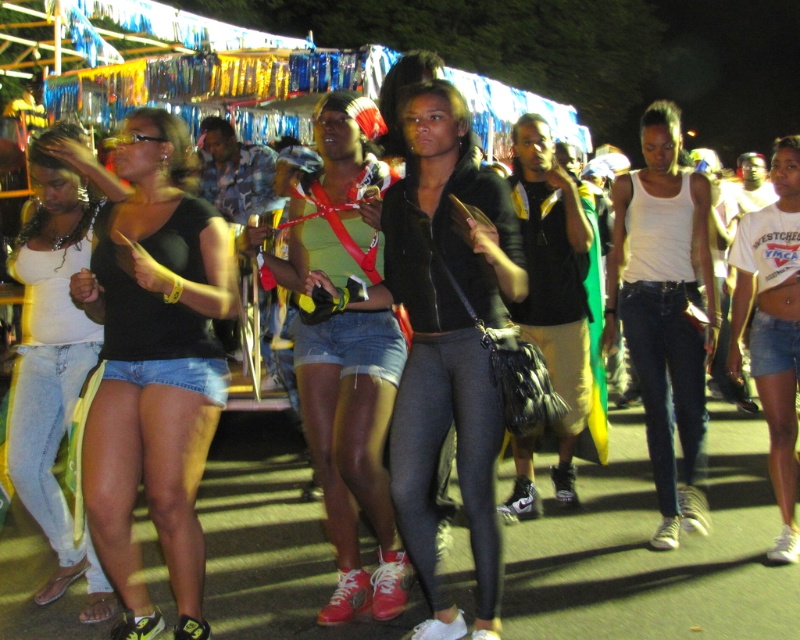
Based on the photo, you are a photographer trying to capture the best shot of the two people at the center of the scene. The denim shorts at center and the white matte tank top at center are both in focus. Which clothing item will appear bigger in your photo?

The denim shorts at center will appear bigger in the photo because it is larger in size than the white matte tank top at center.

You are standing at the origin point of the coordinate system in the image. You need to locate the denim shorts at center. In which direction should you move to reach it?

The denim shorts at center is located at coordinate point 0.700 on the x axis and 0.443 on the y axis. Since you are at the origin, you should move right along the x axis to 0.700 and up along the y axis to 0.443 to reach it.